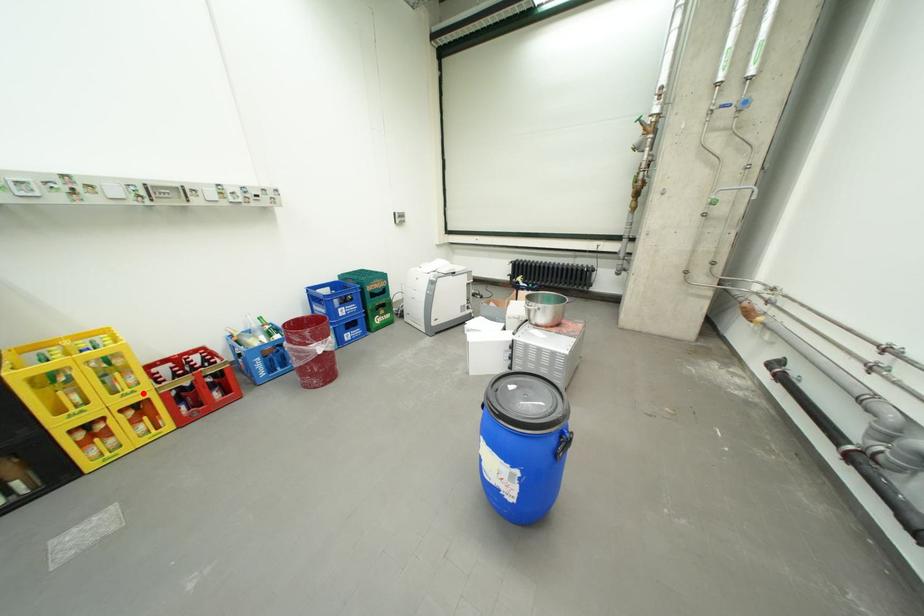
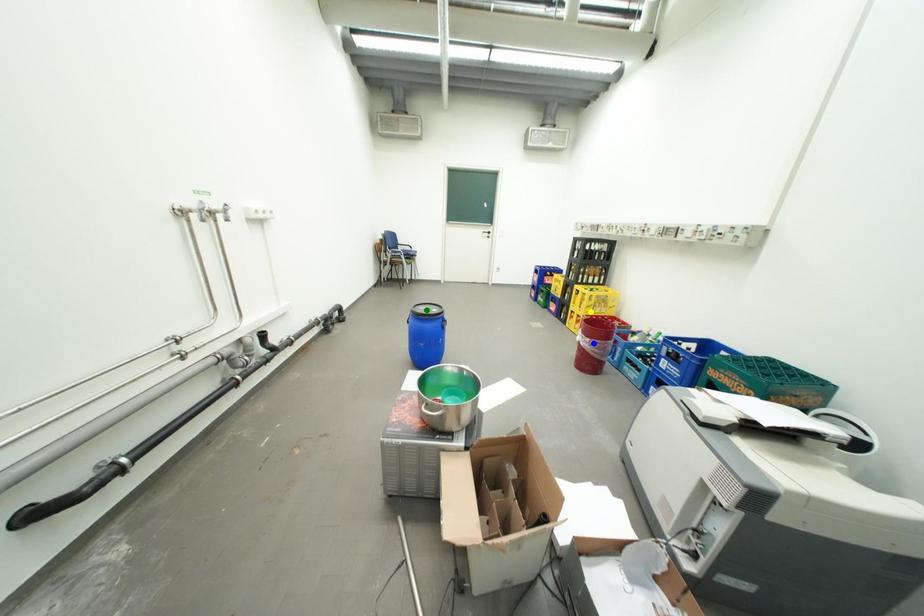
Question: I am providing you with two images of the same scene from different viewpoints. A red point is marked on the first image. You are given multiple points on the second image. Which spot in image 2 lines up with the point in image 1?

Choices:
 (A) blue point
 (B) yellow point
 (C) green point

Answer: (B)